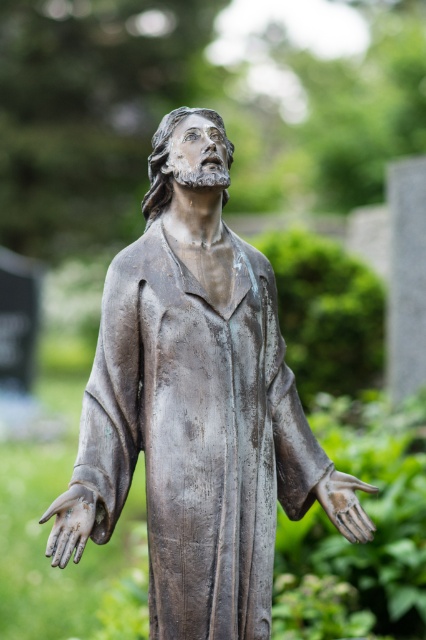
Is bronze textured hand at lower left above bronze textured hand at lower right?

No, bronze textured hand at lower left is not above bronze textured hand at lower right.

Is bronze textured hand at lower left bigger than bronze textured hand at lower right?

Incorrect, bronze textured hand at lower left is not larger than bronze textured hand at lower right.

Where is `bronze textured hand at lower left`? The width and height of the screenshot is (426, 640). bronze textured hand at lower left is located at coordinates (69, 524).

Can you confirm if bronze statue at center is positioned to the right of bronze textured hand at lower right?

In fact, bronze statue at center is to the left of bronze textured hand at lower right.

Is bronze statue at center shorter than bronze textured hand at lower right?

No.

The height and width of the screenshot is (640, 426). In order to click on bronze statue at center in this screenshot , I will do `click(195, 397)`.

Which is behind, point (201, 560) or point (94, 516)?

The point (201, 560) is behind.

Does bronze statue at center have a lesser height compared to bronze textured hand at lower left?

No, bronze statue at center is not shorter than bronze textured hand at lower left.

Image resolution: width=426 pixels, height=640 pixels. What do you see at coordinates (195, 397) in the screenshot? I see `bronze statue at center` at bounding box center [195, 397].

Identify the location of bronze statue at center. This screenshot has height=640, width=426. (195, 397).